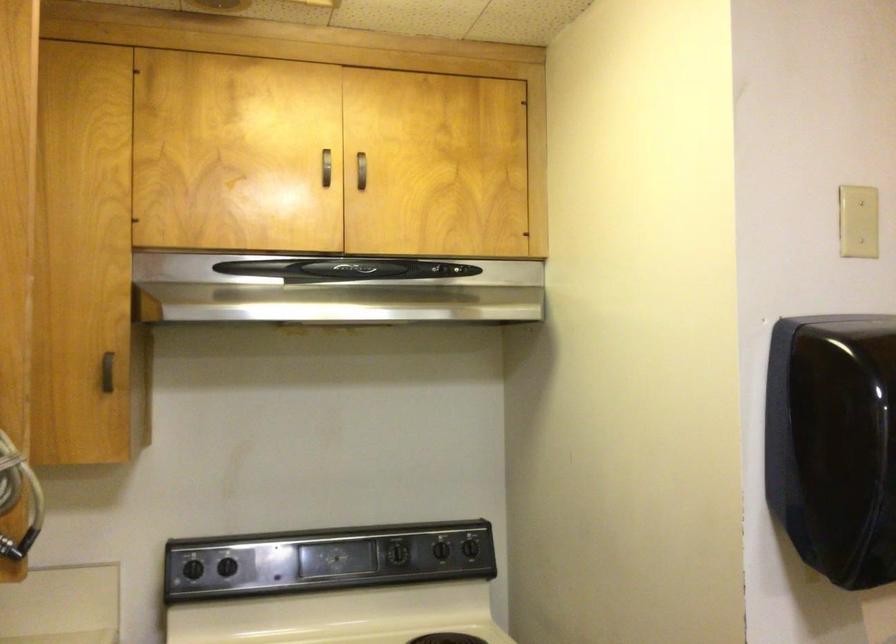
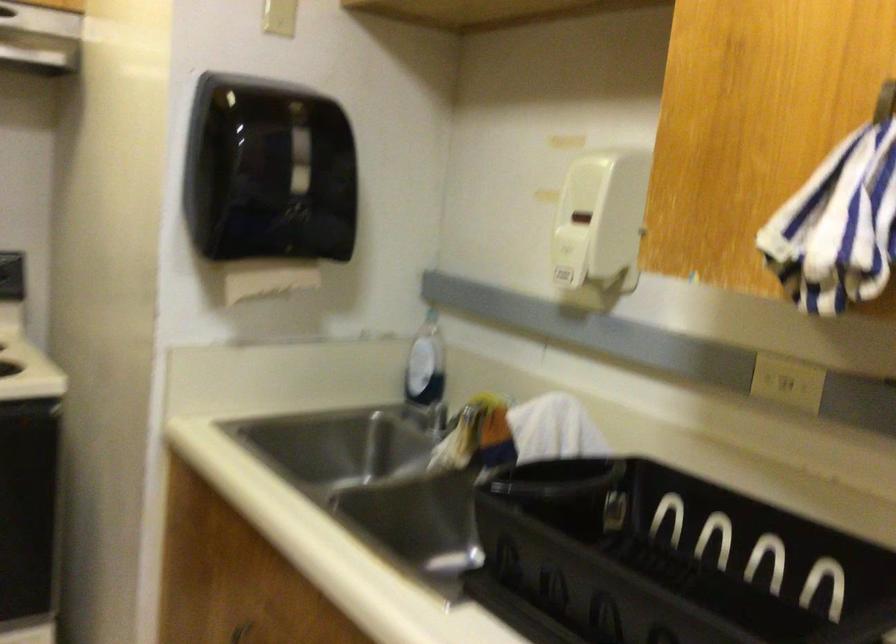
Question: Based on the continuous images, in which direction is the camera rotating? Reply with the corresponding letter.

Choices:
 (A) Left
 (B) Right
 (C) Up
 (D) Down

Answer: (B)